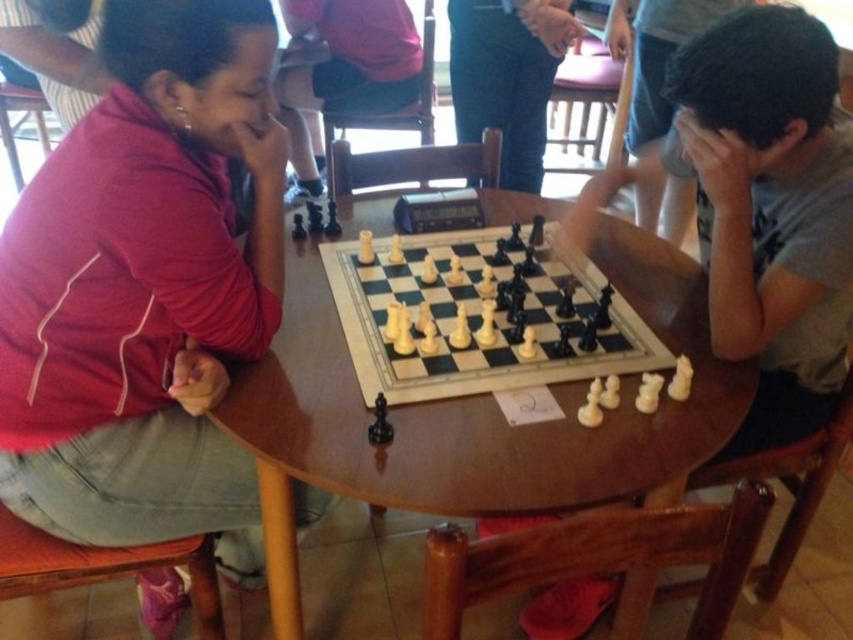
You are a chess player trying to place a new piece on the chessboard. The coordinates given are point (479, 317). Where exactly on the chessboard should you place the new piece?

The point (479, 317) corresponds to the white plastic chess pieces at center, so you should place the new piece at the center of the chessboard where the white plastic chess pieces are located.

You are a chess player observing the game between the two individuals. You notice the white plastic chess pieces at center and the matte black chess piece at upper center. Which set of pieces is positioned closer to the bottom edge of the table?

The white plastic chess pieces at center are positioned closer to the bottom edge of the table because they are located below the matte black chess piece at upper center.